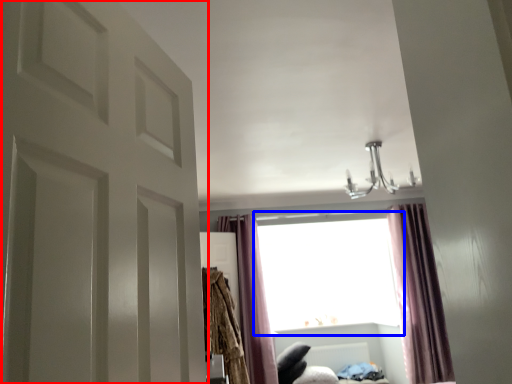
Question: Which point is closer to the camera, door (highlighted by a red box) or window (highlighted by a blue box)?

Choices:
 (A) door
 (B) window

Answer: (A)